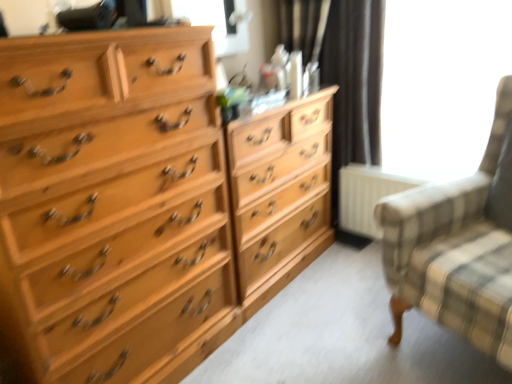
Question: From the image's perspective, is plaid fabric rocking chair at right above or below white matte radiator at lower right?

Choices:
 (A) below
 (B) above

Answer: (A)

Question: From a real-world perspective, is plaid fabric rocking chair at right above or below white matte radiator at lower right?

Choices:
 (A) below
 (B) above

Answer: (B)

Question: Considering the real-world distances, which object is closest to the light wood chest of drawers at left?

Choices:
 (A) plaid fabric rocking chair at right
 (B) white matte radiator at lower right
 (C) transparent glass window at upper right, which is the second window screen from left to right
 (D) light wood dresser at center
 (E) clear glass window screen at upper center, which is counted as the second window screen, starting from the right

Answer: (D)

Question: Which of these objects is positioned farthest from the light wood chest of drawers at left?

Choices:
 (A) white matte radiator at lower right
 (B) light wood dresser at center
 (C) clear glass window screen at upper center, which is the first window screen from left to right
 (D) plaid fabric rocking chair at right
 (E) transparent glass window at upper right, which is the second window screen from left to right

Answer: (E)